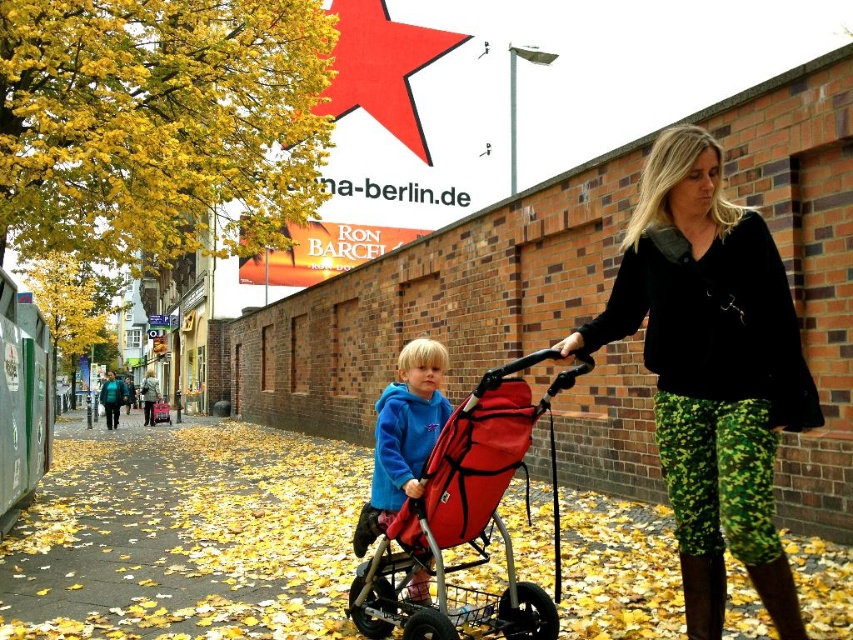
Does red matte star at upper center appear on the right side of blue fleece jacket at center?

Incorrect, red matte star at upper center is not on the right side of blue fleece jacket at center.

Based on the photo, who is more distant from viewer, (379,72) or (404,369)?

Positioned behind is point (379,72).

Find the location of a particular element. red matte star at upper center is located at coordinates (381, 67).

Consider the image. Is yellow leaf-covered pavement at center above blue fleece jacket at center?

Actually, yellow leaf-covered pavement at center is below blue fleece jacket at center.

Is point (630, 625) positioned behind point (405, 387)?

No.

This screenshot has height=640, width=853. What do you see at coordinates (184, 536) in the screenshot?
I see `yellow leaf-covered pavement at center` at bounding box center [184, 536].

At what (x,y) coordinates should I click in order to perform the action: click on yellow leaf-covered pavement at center. Please return your answer as a coordinate pair (x, y). Image resolution: width=853 pixels, height=640 pixels. Looking at the image, I should click on (184, 536).

Can you confirm if camouflage pants at center is bigger than red fabric stroller at center?

Correct, camouflage pants at center is larger in size than red fabric stroller at center.

Which is in front, point (674, 332) or point (579, 365)?

Point (579, 365) is more forward.

You are a GUI agent. You are given a task and a screenshot of the screen. Output one action in this format:
    pyautogui.click(x=<x>, y=<y>)
    Task: Click on the camouflage pants at center
    
    Given the screenshot: What is the action you would take?
    click(x=711, y=371)